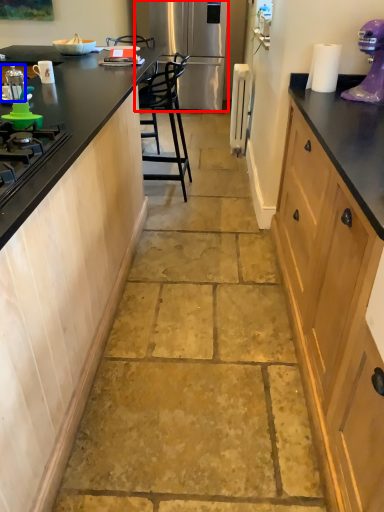
Question: Which point is closer to the camera, refrigerator (highlighted by a red box) or kitchen appliance (highlighted by a blue box)?

Choices:
 (A) refrigerator
 (B) kitchen appliance

Answer: (B)